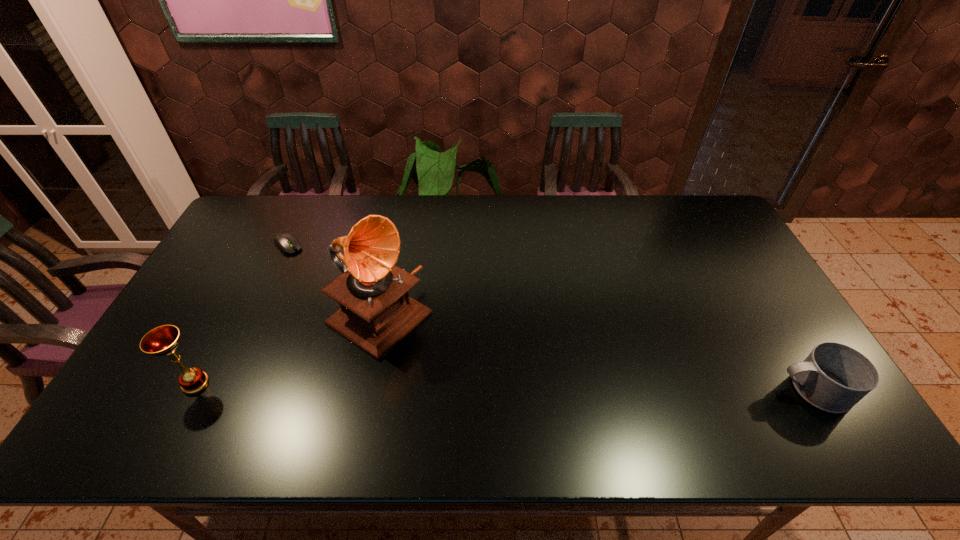
Where is `the third shortest object`? The image size is (960, 540). the third shortest object is located at coordinates (163, 340).

What are the coordinates of `the third tallest object` in the screenshot? It's located at (834, 377).

At what (x,y) coordinates should I click in order to perform the action: click on the rightmost object. Please return your answer as a coordinate pair (x, y). The height and width of the screenshot is (540, 960). Looking at the image, I should click on (834, 377).

Image resolution: width=960 pixels, height=540 pixels. Find the location of `the third object from left to right`. the third object from left to right is located at coordinates (376, 313).

Where is `the tallest object`? This screenshot has height=540, width=960. the tallest object is located at coordinates (376, 313).

The image size is (960, 540). What are the coordinates of `computer mouse` in the screenshot? It's located at (285, 242).

Identify the location of the farthest object. The width and height of the screenshot is (960, 540). (285, 242).

Locate an element on the screen. This screenshot has width=960, height=540. free space located on the right of the chalice is located at coordinates (320, 383).

This screenshot has width=960, height=540. Identify the location of vacant space positioned on the side of the second shortest object with the handle. (637, 389).

The width and height of the screenshot is (960, 540). Identify the location of free point located on the side of the second shortest object with the handle. (666, 389).